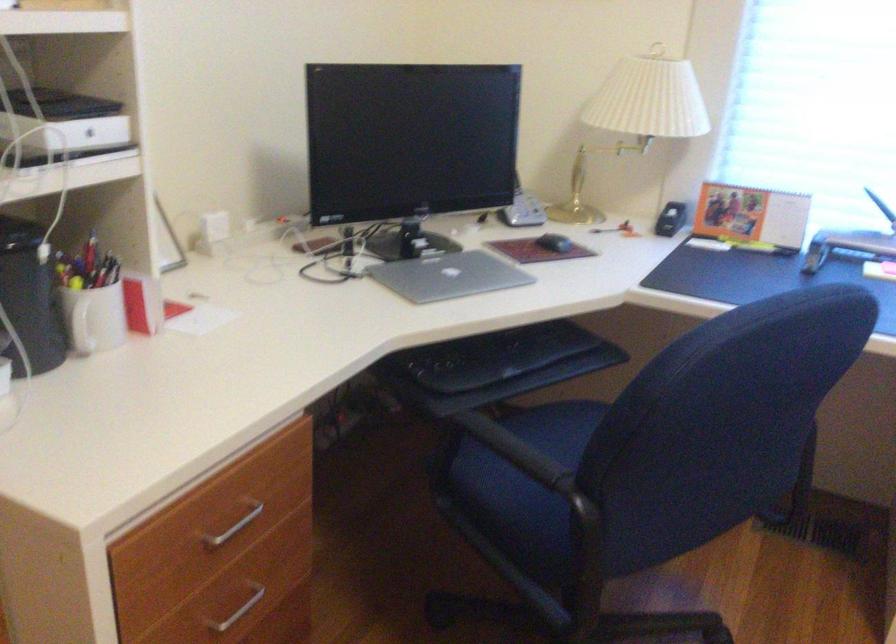
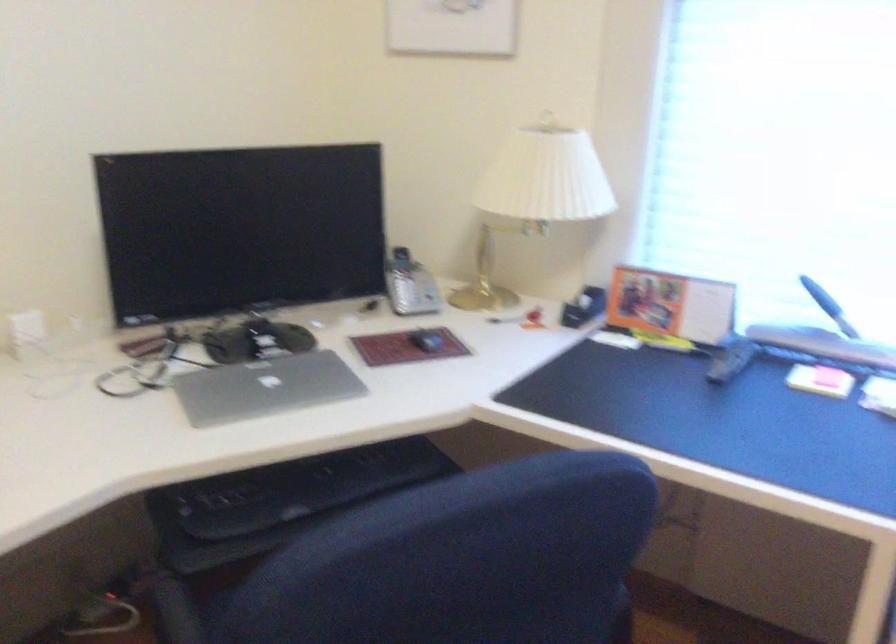
The point at (449,276) is marked in the first image. Where is the corresponding point in the second image?

(264, 386)